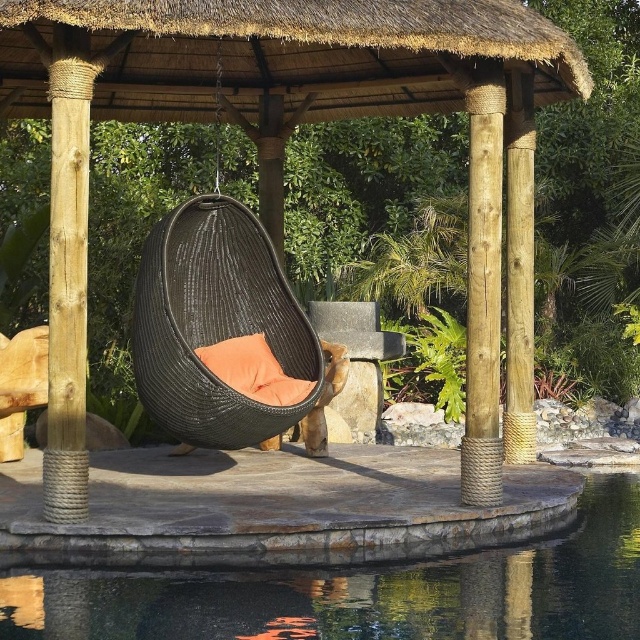
Does rope-wrapped wood pole at right have a lesser height compared to orange woven pillow at center?

No.

Based on the photo, can you confirm if rope-wrapped wood pole at right is thinner than orange woven pillow at center?

Yes, rope-wrapped wood pole at right is thinner than orange woven pillow at center.

Identify the location of rope-wrapped wood pole at right. (518, 269).

Identify the location of rope-wrapped wood pole at right. This screenshot has height=640, width=640. (518, 269).

Is point (212, 602) positioned before point (236, 340)?

Yes, point (212, 602) is in front of point (236, 340).

Between transparent glass pond at center and orange woven pillow at center, which one has less height?

Standing shorter between the two is transparent glass pond at center.

Between point (266, 596) and point (276, 401), which one is positioned in front?

Point (266, 596) is more forward.

Identify the location of transparent glass pond at center. This screenshot has height=640, width=640. 356,589.

Is point (477, 308) behind point (266, 342)?

That is False.

Which of these two, natural wood pole at center or orange woven pillow at center, stands taller?

Standing taller between the two is natural wood pole at center.

Which is in front, point (481, 122) or point (289, 400)?

Positioned in front is point (481, 122).

The height and width of the screenshot is (640, 640). I want to click on natural wood pole at center, so click(483, 285).